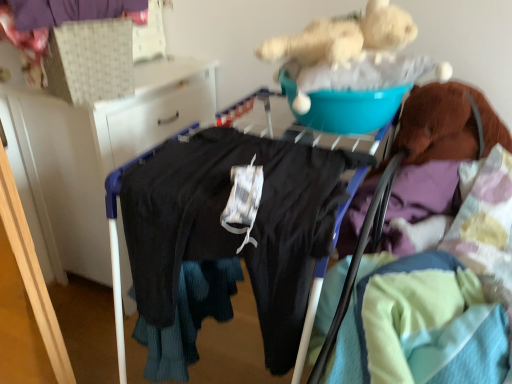
Question: Which direction should I rotate to look at black matte pants at center, placed as the second clothing when sorted from left to right, — up or down?

Choices:
 (A) up
 (B) down

Answer: (B)

Question: Is black fabric at left positioned with its back to black matte pants at center, the 2th clothing when ordered from top to bottom?

Choices:
 (A) yes
 (B) no

Answer: (B)

Question: Can you confirm if black fabric at left is thinner than black matte pants at center, placed as the second clothing when sorted from left to right?

Choices:
 (A) no
 (B) yes

Answer: (B)

Question: Is the position of black fabric at left less distant than that of black matte pants at center, which appears as the 1th clothing when viewed from the right?

Choices:
 (A) yes
 (B) no

Answer: (B)

Question: Can we say black fabric at left lies outside black matte pants at center, the first clothing positioned from the bottom?

Choices:
 (A) yes
 (B) no

Answer: (A)

Question: Is black fabric at left far away from black matte pants at center, the 2th clothing when ordered from top to bottom?

Choices:
 (A) no
 (B) yes

Answer: (A)

Question: Is black fabric at left beside black matte pants at center, the 2th clothing when ordered from top to bottom?

Choices:
 (A) no
 (B) yes

Answer: (A)

Question: Is purple fabric at upper left, which is counted as the 2th clothing, starting from the bottom, to the left of black matte pants at center, the first clothing positioned from the bottom, from the viewer's perspective?

Choices:
 (A) yes
 (B) no

Answer: (A)

Question: From a real-world perspective, is purple fabric at upper left, which ranks as the second clothing in right-to-left order, on black matte pants at center, placed as the second clothing when sorted from left to right?

Choices:
 (A) no
 (B) yes

Answer: (B)

Question: Considering the relative positions of purple fabric at upper left, which ranks as the second clothing in right-to-left order, and black matte pants at center, which appears as the 1th clothing when viewed from the right, in the image provided, is purple fabric at upper left, which ranks as the second clothing in right-to-left order, in front of black matte pants at center, which appears as the 1th clothing when viewed from the right,?

Choices:
 (A) no
 (B) yes

Answer: (A)

Question: Is purple fabric at upper left, the 1th clothing viewed from the left, turned away from black matte pants at center, which appears as the 1th clothing when viewed from the right?

Choices:
 (A) no
 (B) yes

Answer: (A)

Question: From a real-world perspective, is purple fabric at upper left, which is counted as the 2th clothing, starting from the bottom, physically below black matte pants at center, which appears as the 1th clothing when viewed from the right?

Choices:
 (A) no
 (B) yes

Answer: (A)

Question: Considering the relative positions of purple fabric at upper left, the first clothing from the top, and black matte pants at center, the first clothing positioned from the bottom, in the image provided, is purple fabric at upper left, the first clothing from the top, to the right of black matte pants at center, the first clothing positioned from the bottom, from the viewer's perspective?

Choices:
 (A) yes
 (B) no

Answer: (B)

Question: Can you confirm if black matte pants at center, which appears as the 1th clothing when viewed from the right, is taller than black fabric at left?

Choices:
 (A) yes
 (B) no

Answer: (B)